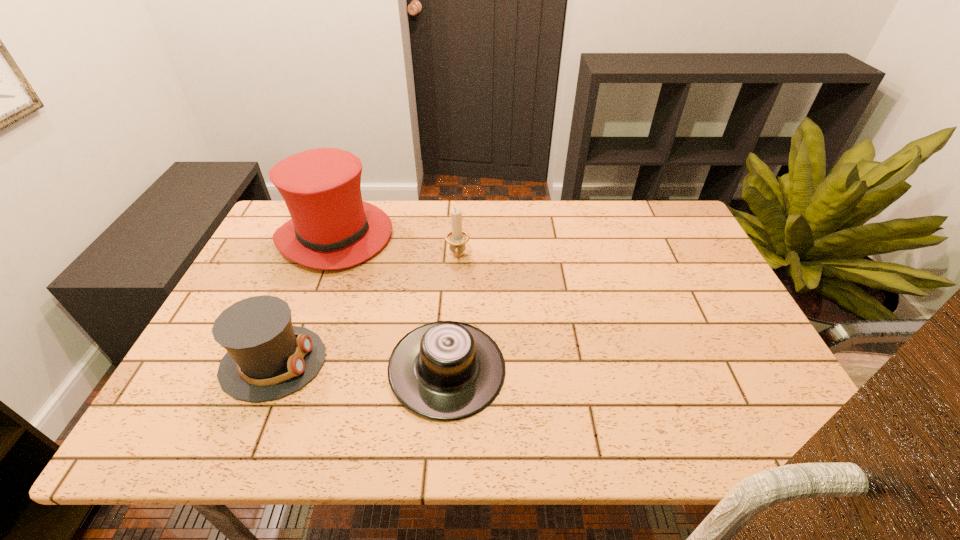
You are a GUI agent. You are given a task and a screenshot of the screen. Output one action in this format:
    pyautogui.click(x=<x>, y=<y>)
    Task: Click on the object that is at the far edge
    The width and height of the screenshot is (960, 540).
    Given the screenshot: What is the action you would take?
    pyautogui.click(x=331, y=228)

I want to click on object that is at the near edge, so click(446, 370).

At what (x,y) coordinates should I click in order to perform the action: click on object that is at the far left corner. Please return your answer as a coordinate pair (x, y). The image size is (960, 540). Looking at the image, I should click on (331, 228).

Find the location of a particular element. The image size is (960, 540). vacant region at the far edge of the desktop is located at coordinates (528, 231).

Locate an element on the screen. free location at the near edge of the desktop is located at coordinates (511, 442).

Image resolution: width=960 pixels, height=540 pixels. I want to click on vacant space at the left edge of the desktop, so click(x=248, y=269).

Locate an element on the screen. vacant space at the right edge of the desktop is located at coordinates (x=697, y=273).

This screenshot has width=960, height=540. In the image, there is a desktop. In order to click on vacant space at the near left corner in this screenshot , I will do `click(243, 410)`.

Locate an element on the screen. The image size is (960, 540). free region at the far right corner is located at coordinates (662, 208).

Image resolution: width=960 pixels, height=540 pixels. Identify the location of vacant space that's between the tallest object and the shortest dress hat. (391, 303).